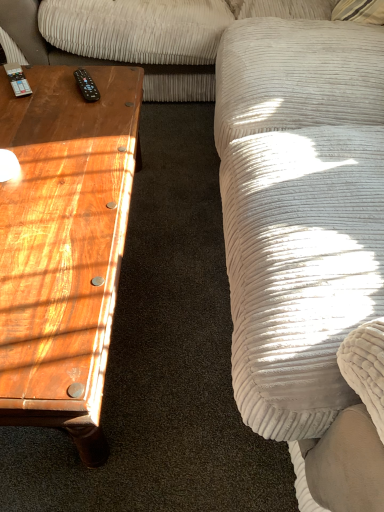
Question: Is there a large distance between wooden coffee table at left and black plastic remote at upper left?

Choices:
 (A) no
 (B) yes

Answer: (A)

Question: Is wooden coffee table at left touching black plastic remote at upper left?

Choices:
 (A) no
 (B) yes

Answer: (A)

Question: Does wooden coffee table at left have a lesser height compared to black plastic remote at upper left?

Choices:
 (A) yes
 (B) no

Answer: (B)

Question: Does wooden coffee table at left turn towards black plastic remote at upper left?

Choices:
 (A) no
 (B) yes

Answer: (A)

Question: From a real-world perspective, is wooden coffee table at left on black plastic remote at upper left?

Choices:
 (A) yes
 (B) no

Answer: (B)

Question: Can we say wooden coffee table at left lies outside black plastic remote at upper left?

Choices:
 (A) no
 (B) yes

Answer: (B)

Question: Is black plastic remote at upper left next to wooden coffee table at left and touching it?

Choices:
 (A) yes
 (B) no

Answer: (B)

Question: Is black plastic remote at upper left positioned beyond the bounds of wooden coffee table at left?

Choices:
 (A) yes
 (B) no

Answer: (B)

Question: Does black plastic remote at upper left lie in front of wooden coffee table at left?

Choices:
 (A) no
 (B) yes

Answer: (A)

Question: Is black plastic remote at upper left shorter than wooden coffee table at left?

Choices:
 (A) no
 (B) yes

Answer: (B)

Question: Is black plastic remote at upper left at the left side of wooden coffee table at left?

Choices:
 (A) no
 (B) yes

Answer: (A)

Question: Considering the relative sizes of black plastic remote at upper left and wooden coffee table at left in the image provided, is black plastic remote at upper left smaller than wooden coffee table at left?

Choices:
 (A) no
 (B) yes

Answer: (B)

Question: Is black plastic remote at upper left inside or outside of wooden coffee table at left?

Choices:
 (A) outside
 (B) inside

Answer: (B)